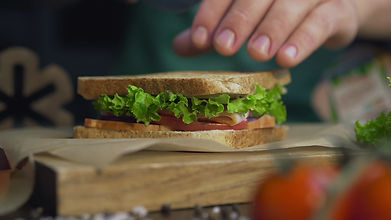
Identify the location of cutting board. (217, 174).